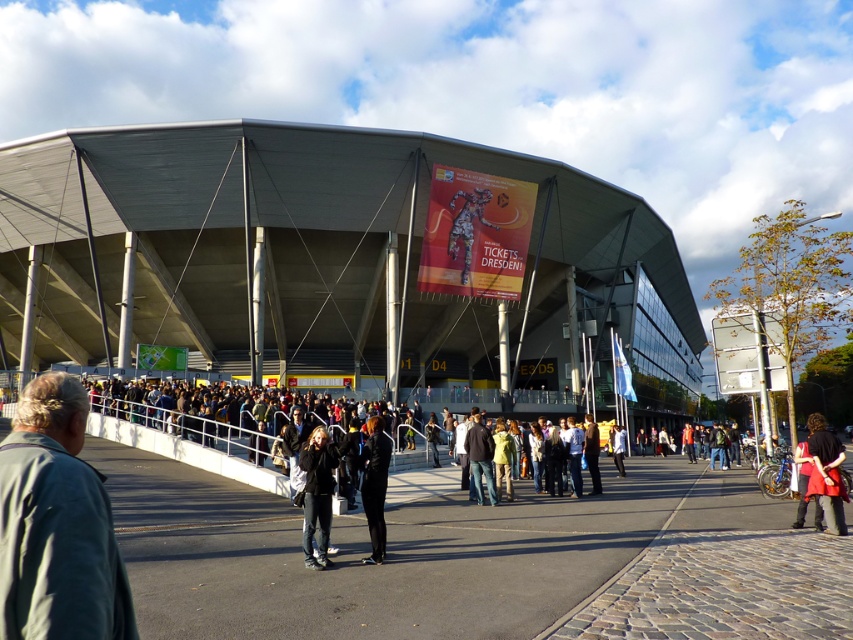
You are standing at the entrance of the stadium and see a person wearing a dark gray jacket at lower left. If you want to locate them precisely, what coordinates would you use?

The dark gray jacket at lower left is located at coordinates point [56,524].

You are standing at the entrance of the stadium and see a person wearing a red fabric coat at lower right and another wearing jeans at center. Which clothing item is positioned more to the right side of the scene?

The red fabric coat at lower right is positioned more to the right side of the scene compared to the jeans at center as it is located to the right of the jeans at center.